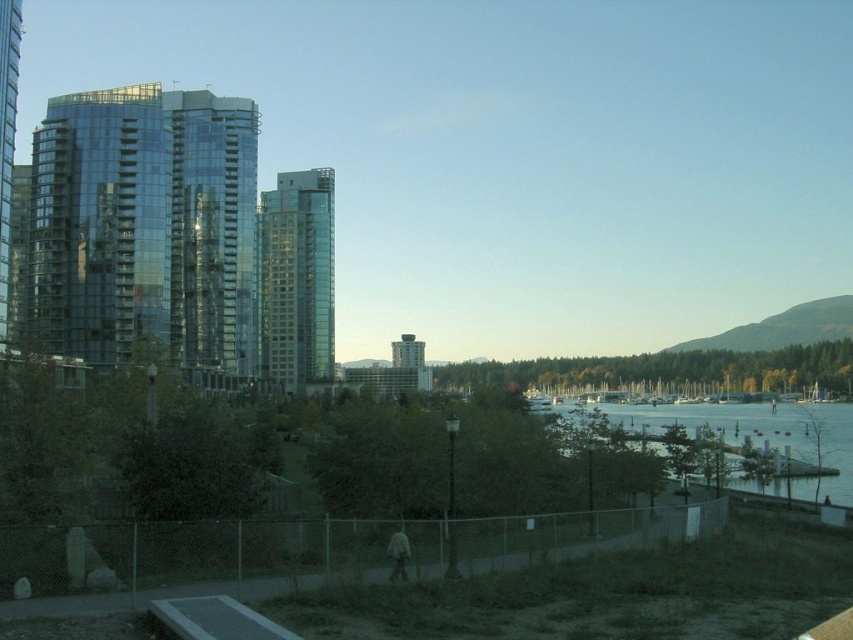
You are an architect evaluating the urban skyline. Based on the scene, which of the two buildings, the glassy reflective building at center or the matte gray tower at center, is taller?

The glassy reflective building at center is taller than the matte gray tower at center according to the description.

You are standing at the waterfront and want to take a photo of the glassy reflective building at center and the clear water at lower right. Which object should you frame first in your camera to ensure both are in the shot?

You should frame the glassy reflective building at center first since it is positioned on the left side of the clear water at lower right, so starting with the building ensures both objects are included in the frame.